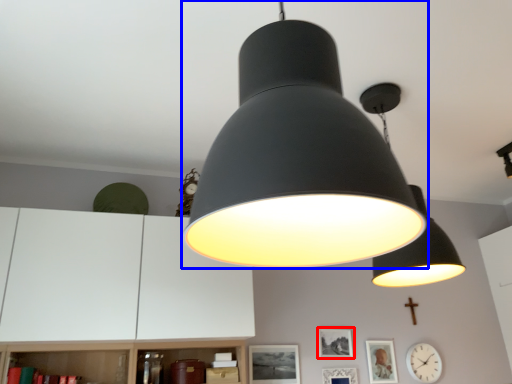
Question: Among these objects, which one is farthest to the camera, picture frame (highlighted by a red box) or lamp (highlighted by a blue box)?

Choices:
 (A) picture frame
 (B) lamp

Answer: (A)